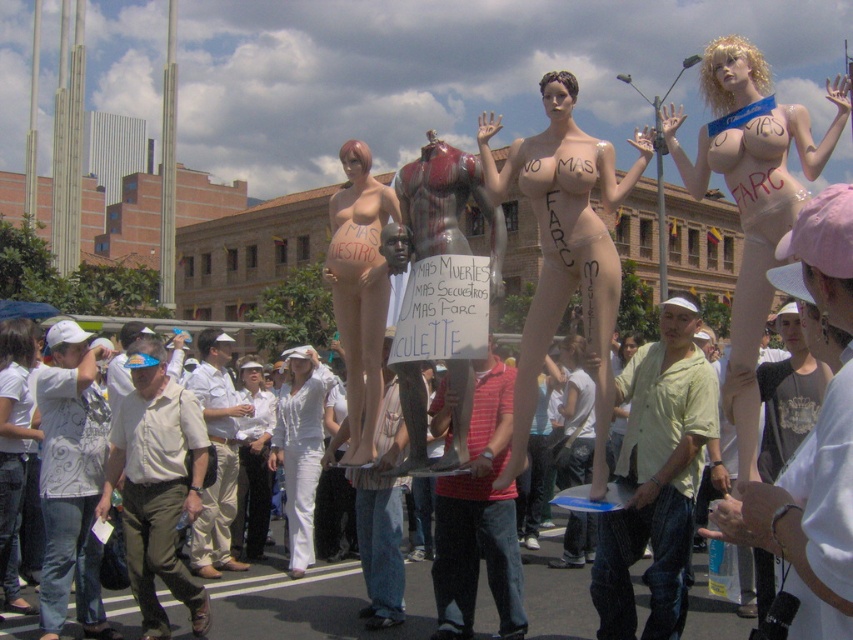
You are a photographer standing in the crowd at the protest. You want to take a photo of both the mannequin with the message at point (593,448) and the sign at point (239,428). Will both objects be in focus if you focus on the closer one?

Point 0.700, 0696 is further to the camera than point (239,428). If you focus on the closer one, the further one may be out of focus depending on the camera settings. To ensure both are in focus, adjust the focus or use a smaller aperture for a deeper depth of field.